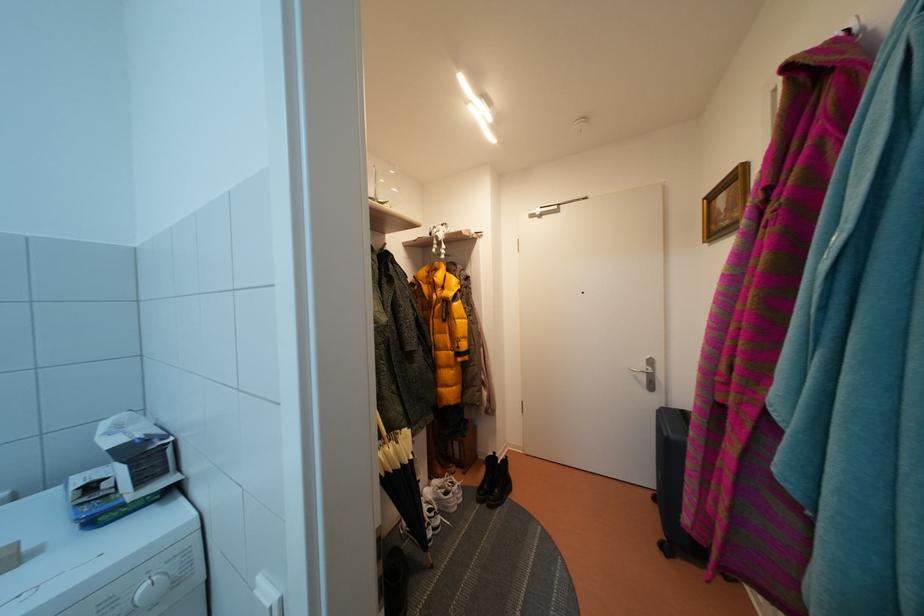
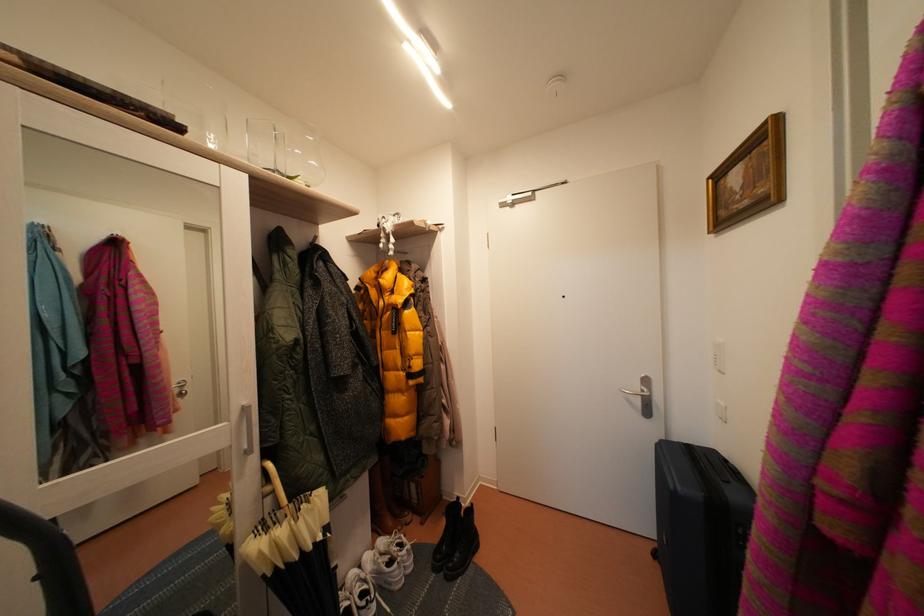
Where in the second image is the point corresponding to point 650,371 from the first image?

(645, 392)